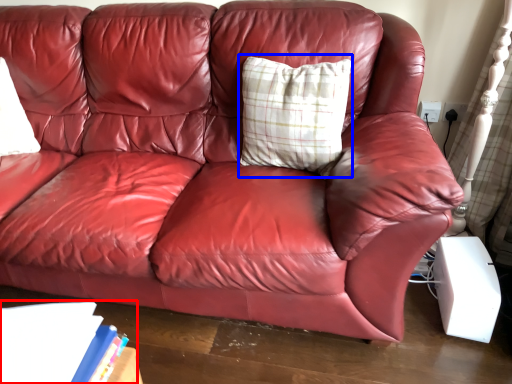
Question: Which object appears farthest to the camera in this image, book (highlighted by a red box) or pillow (highlighted by a blue box)?

Choices:
 (A) book
 (B) pillow

Answer: (B)